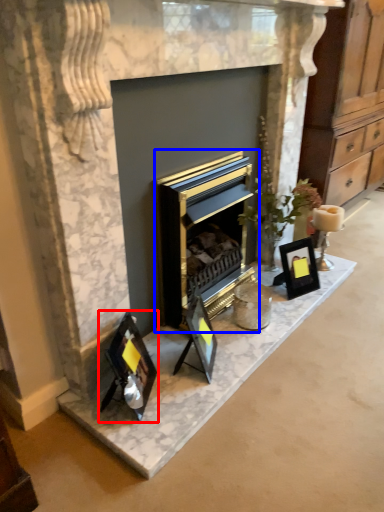
Question: Which object is further to the camera taking this photo, picture frame (highlighted by a red box) or fireplace (highlighted by a blue box)?

Choices:
 (A) picture frame
 (B) fireplace

Answer: (B)